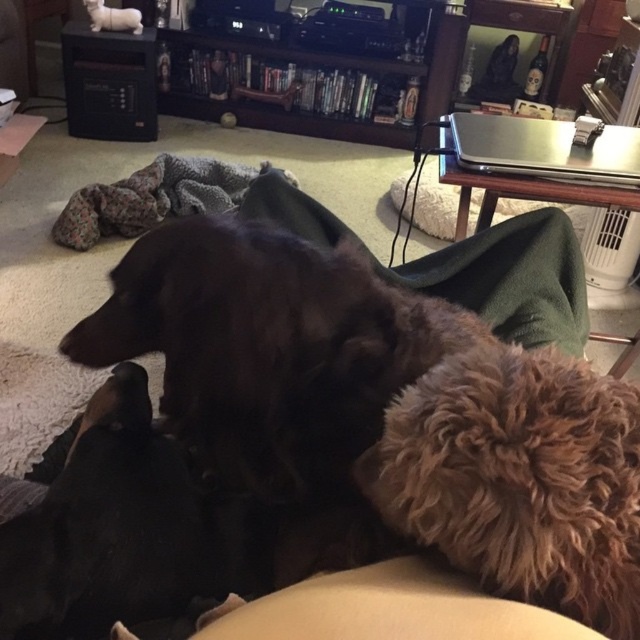
Consider the image. Can you confirm if shiny black dog at center is thinner than green soft blanket at center?

Indeed, shiny black dog at center has a lesser width compared to green soft blanket at center.

Which of these two, shiny black dog at center or green soft blanket at center, stands shorter?

With less height is green soft blanket at center.

The image size is (640, 640). I want to click on shiny black dog at center, so (x=275, y=365).

Between green soft blanket at center and white plush cat at upper left, which one has less height?

Standing shorter between the two is white plush cat at upper left.

Based on the photo, who is lower down, green soft blanket at center or white plush cat at upper left?

green soft blanket at center

Between point (294, 230) and point (138, 32), which one is positioned behind?

Positioned behind is point (138, 32).

At what (x,y) coordinates should I click in order to perform the action: click on green soft blanket at center. Please return your answer as a coordinate pair (x, y). The image size is (640, 640). Looking at the image, I should click on (509, 278).

Does shiny black dog at center have a lesser width compared to white plush cat at upper left?

Incorrect, shiny black dog at center's width is not less than white plush cat at upper left's.

Which is above, shiny black dog at center or white plush cat at upper left?

white plush cat at upper left is above.

Where is `shiny black dog at center`? shiny black dog at center is located at coordinates (275, 365).